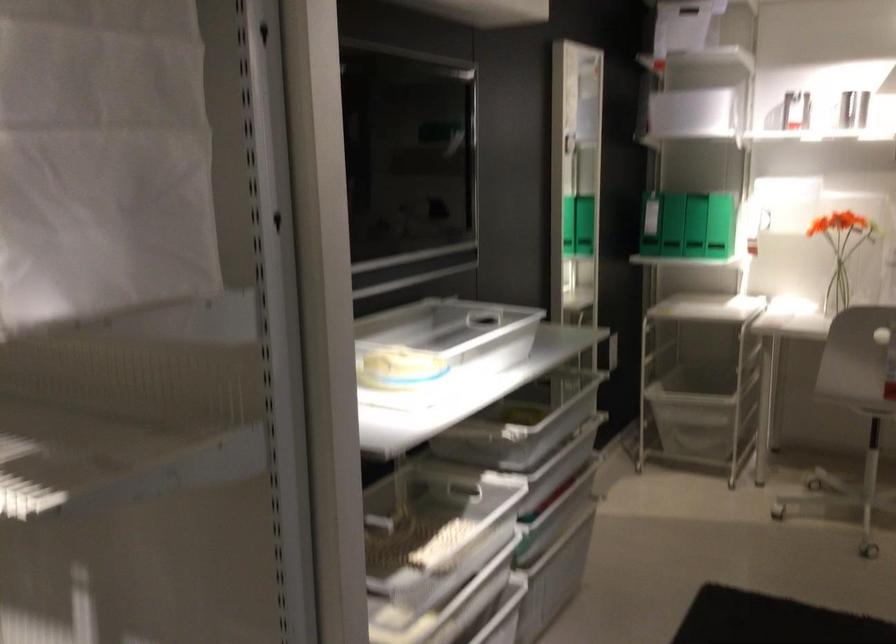
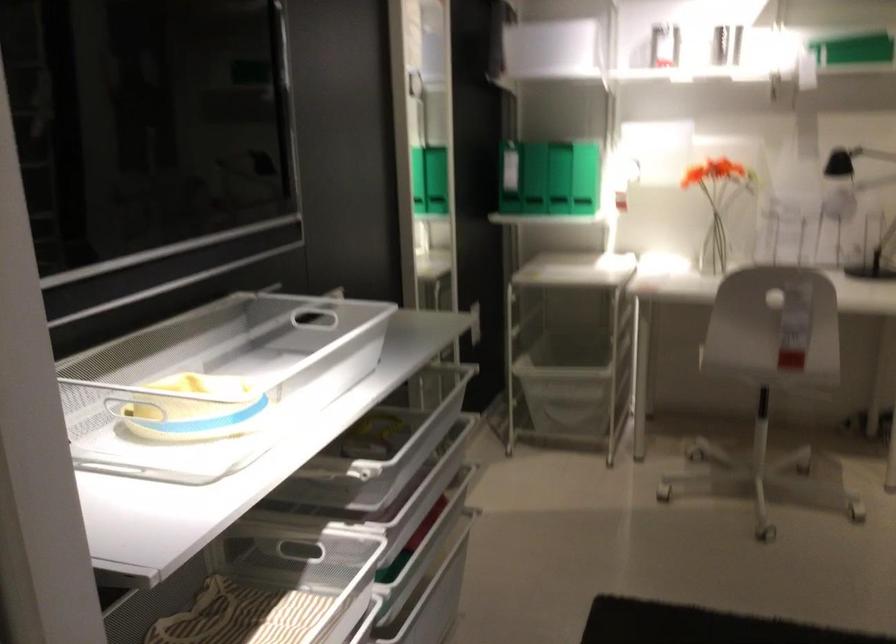
Where in the second image is the point corresponding to point 403,357 from the first image?

(216, 383)